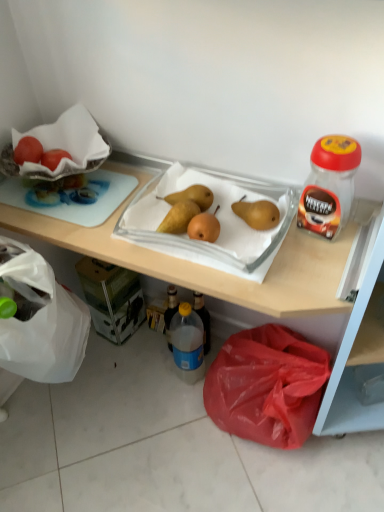
Where is `vacant region to the left of red plastic bag at lower center`? vacant region to the left of red plastic bag at lower center is located at coordinates (162, 416).